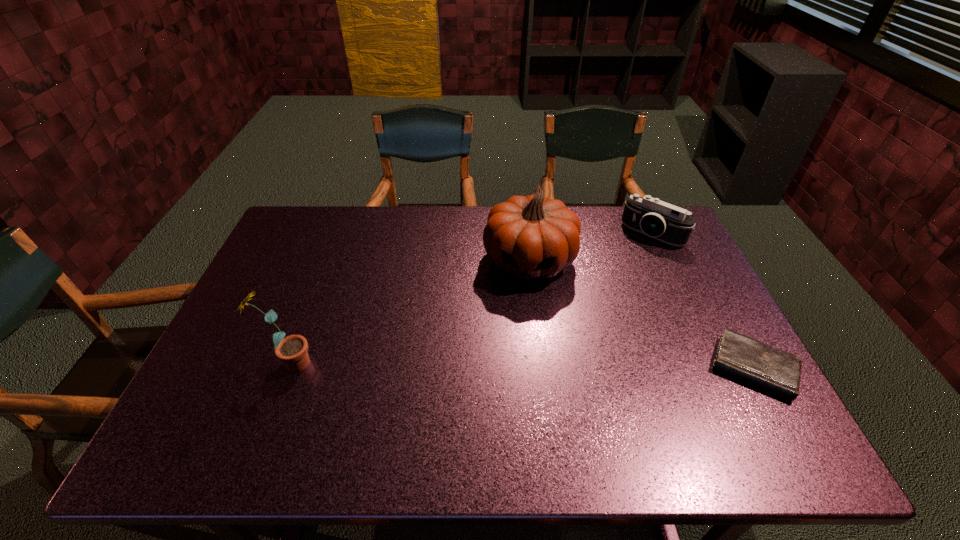
Where is `vacant area at the far edge`? vacant area at the far edge is located at coordinates (440, 210).

Find the location of a particular element. free region at the near edge is located at coordinates (363, 387).

In the image, there is a desktop. Identify the location of free space at the left edge. The width and height of the screenshot is (960, 540). (282, 279).

I want to click on vacant space at the right edge of the desktop, so pyautogui.click(x=704, y=336).

In the image, there is a desktop. At what (x,y) coordinates should I click in order to perform the action: click on vacant region at the far right corner. Please return your answer as a coordinate pair (x, y). This screenshot has width=960, height=540. Looking at the image, I should click on (666, 245).

Find the location of a particular element. vacant area that lies between the shortest object and the camera is located at coordinates (703, 301).

Locate an element on the screen. The height and width of the screenshot is (540, 960). vacant space that is in between the third tallest object and the pumpkin is located at coordinates (590, 247).

Where is `free area in between the second shortest object and the leftmost object`? free area in between the second shortest object and the leftmost object is located at coordinates (470, 299).

In order to click on blank region between the leftmost object and the second object from left to right in this screenshot , I will do click(409, 312).

Locate an element on the screen. vacant space that's between the sunflower and the second object from left to right is located at coordinates (409, 312).